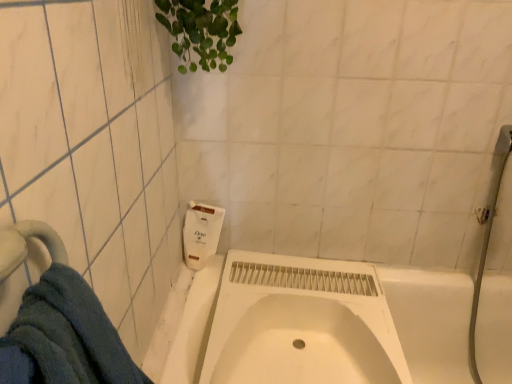
Question: Considering the positions of white matte sink at center and blue cotton towel at lower left in the image, is white matte sink at center taller or shorter than blue cotton towel at lower left?

Choices:
 (A) tall
 (B) short

Answer: (B)

Question: Is white matte sink at center in front of or behind blue cotton towel at lower left in the image?

Choices:
 (A) front
 (B) behind

Answer: (B)

Question: Based on their relative distances, which object is farther from the white matte sink at center?

Choices:
 (A) white matte soap dispenser at upper center
 (B) blue cotton towel at lower left
 (C) white matte bathtub at center

Answer: (B)

Question: Based on their relative distances, which object is nearer to the white matte bathtub at center?

Choices:
 (A) white matte soap dispenser at upper center
 (B) white matte sink at center
 (C) blue cotton towel at lower left

Answer: (B)